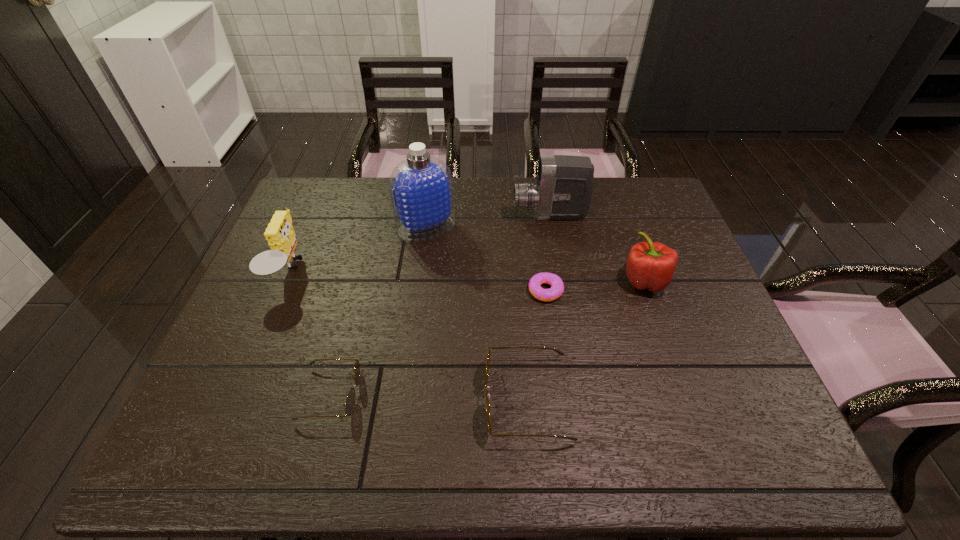
The height and width of the screenshot is (540, 960). I want to click on doughnut, so click(557, 286).

At what (x,y) coordinates should I click in order to perform the action: click on free space located on the lenses of the sixth object from right to left. Please return your answer as a coordinate pair (x, y). Image resolution: width=960 pixels, height=540 pixels. Looking at the image, I should click on (442, 394).

Locate an element on the screen. This screenshot has width=960, height=540. free point located on the lenses of the right sunglasses is located at coordinates (346, 399).

Where is `free region located on the lenses of the right sunglasses`? This screenshot has height=540, width=960. free region located on the lenses of the right sunglasses is located at coordinates [341, 399].

I want to click on vacant point located on the lenses of the right sunglasses, so click(355, 399).

You are a GUI agent. You are given a task and a screenshot of the screen. Output one action in this format:
    pyautogui.click(x=<x>, y=<y>)
    Task: Click on the vacant space positioned at the front of the camcorder, highlighting the lens
    The image size is (960, 540).
    Given the screenshot: What is the action you would take?
    pyautogui.click(x=387, y=215)

I want to click on blank space located at the front of the camcorder, highlighting the lens, so click(x=434, y=215).

You are a GUI agent. You are given a task and a screenshot of the screen. Output one action in this format:
    pyautogui.click(x=<x>, y=<y>)
    Task: Click on the vacant space situated at the front of the camcorder, highlighting the lens
    The image size is (960, 540).
    Given the screenshot: What is the action you would take?
    pyautogui.click(x=412, y=215)

Identify the location of free spot located 0.090m on the left of the fifth object from right to left. Image resolution: width=960 pixels, height=540 pixels. 368,228.

What are the coordinates of `free location located on the front-facing side of the leftmost object` in the screenshot? It's located at (410, 271).